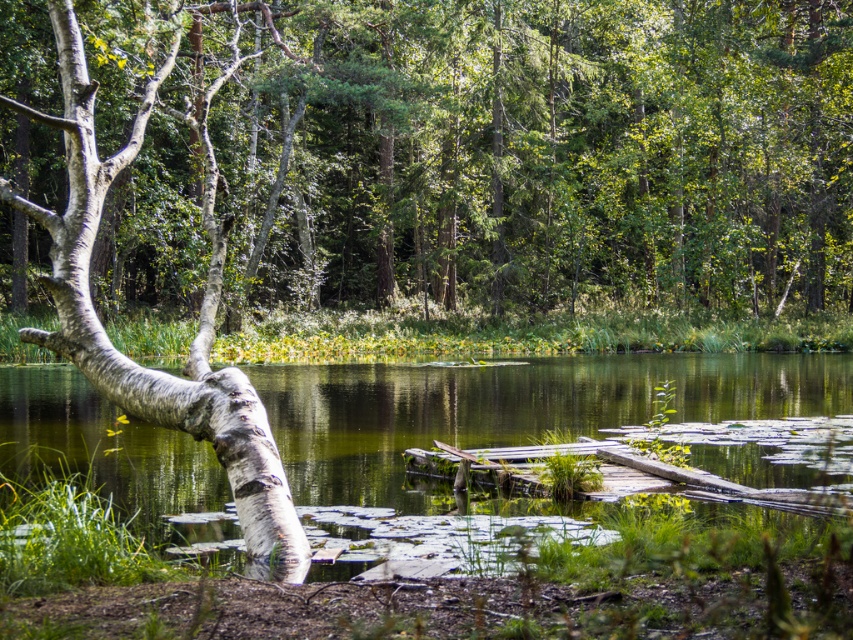
Can you confirm if white bark tree at left is positioned below white bark tree trunk at left?

No.

Who is positioned more to the right, white bark tree at left or white bark tree trunk at left?

white bark tree at left

Identify the location of white bark tree at left. The width and height of the screenshot is (853, 640). (529, 148).

Identify the location of white bark tree at left. click(x=529, y=148).

Can you confirm if green mossy log at center is positioned to the left of white bark tree trunk at left?

Yes, green mossy log at center is to the left of white bark tree trunk at left.

Can you confirm if green mossy log at center is wider than white bark tree trunk at left?

Yes.

Based on the photo, who is more forward, [270,369] or [241,522]?

Point [241,522] is more forward.

You are a GUI agent. You are given a task and a screenshot of the screen. Output one action in this format:
    pyautogui.click(x=<x>, y=<y>)
    Task: Click on the green mossy log at center
    
    Given the screenshot: What is the action you would take?
    pyautogui.click(x=508, y=408)

Measure the distance between white bark tree at left and camera.

white bark tree at left is 8.34 meters from camera.

Identify the location of white bark tree at left. This screenshot has width=853, height=640. (529, 148).